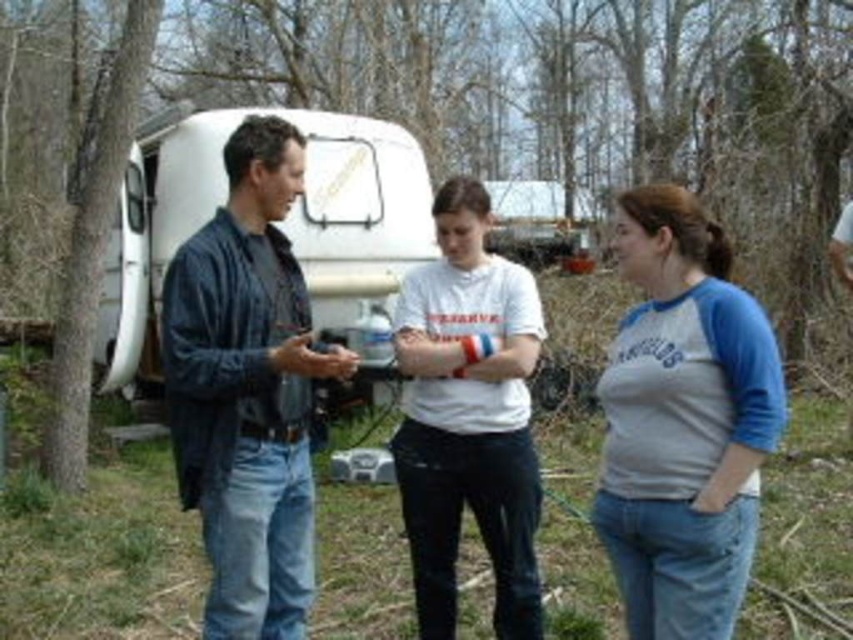
Does denim jacket at center have a greater width compared to white matte t-shirt at center?

Correct, the width of denim jacket at center exceeds that of white matte t-shirt at center.

Can you confirm if denim jacket at center is smaller than white matte t-shirt at center?

Correct, denim jacket at center occupies less space than white matte t-shirt at center.

Between point (233, 362) and point (492, 280), which one is positioned in front?

Positioned in front is point (233, 362).

I want to click on denim jacket at center, so click(x=248, y=388).

Which is below, gray cotton shirt at center or white matte t-shirt at center?

white matte t-shirt at center

This screenshot has height=640, width=853. What do you see at coordinates (683, 422) in the screenshot?
I see `gray cotton shirt at center` at bounding box center [683, 422].

Find the location of a particular element. gray cotton shirt at center is located at coordinates (683, 422).

Who is higher up, denim jacket at center or white matte recreational vehicle at center?

white matte recreational vehicle at center is above.

Where is `denim jacket at center`? denim jacket at center is located at coordinates [248, 388].

Is point (196, 342) closer to viewer compared to point (393, 148)?

Yes, it is.

You are a GUI agent. You are given a task and a screenshot of the screen. Output one action in this format:
    pyautogui.click(x=<x>, y=<y>)
    Task: Click on the denim jacket at center
    The height and width of the screenshot is (640, 853).
    Given the screenshot: What is the action you would take?
    pyautogui.click(x=248, y=388)